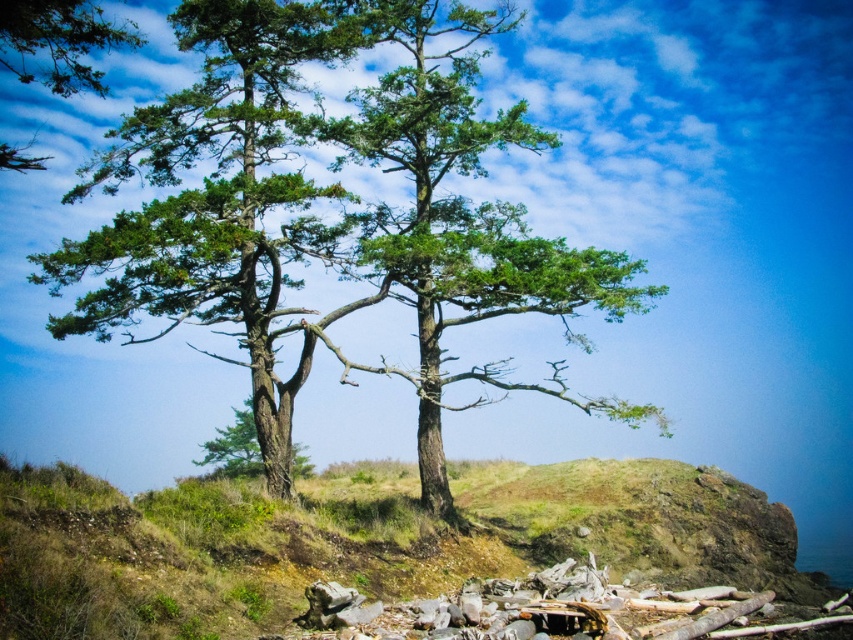
Does green textured tree at center have a greater width compared to green matte tree at upper left?

Correct, the width of green textured tree at center exceeds that of green matte tree at upper left.

Does green textured tree at center have a greater height compared to green matte tree at upper left?

Yes, green textured tree at center is taller than green matte tree at upper left.

This screenshot has width=853, height=640. I want to click on green textured tree at center, so click(328, 212).

From the picture: Can you confirm if green textured tree at center is positioned below green rough bark tree at center?

Actually, green textured tree at center is above green rough bark tree at center.

Is green textured tree at center positioned behind green rough bark tree at center?

No, green textured tree at center is closer to the viewer.

This screenshot has width=853, height=640. In order to click on green textured tree at center in this screenshot , I will do [x=328, y=212].

This screenshot has height=640, width=853. I want to click on green textured tree at center, so click(x=328, y=212).

Between green textured tree at center and green grassy hillside at center, which one appears on the right side from the viewer's perspective?

green grassy hillside at center

Measure the distance between green textured tree at center and camera.

They are 24.09 meters apart.

Who is more forward, (428, 259) or (103, 524)?

Positioned in front is point (103, 524).

Where is `green textured tree at center`? green textured tree at center is located at coordinates (328, 212).